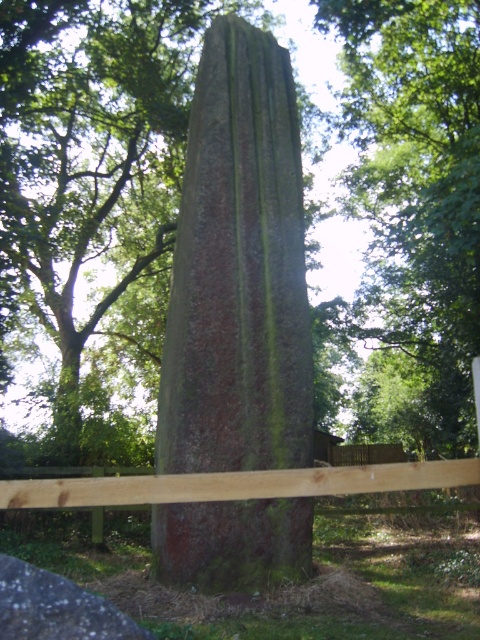
Who is higher up, green mossy stone obelisk at center or green mossy stone at center?

green mossy stone obelisk at center is higher up.

Does green mossy stone obelisk at center have a lesser height compared to green mossy stone at center?

No, green mossy stone obelisk at center is not shorter than green mossy stone at center.

What are the coordinates of `green mossy stone obelisk at center` in the screenshot? It's located at (96, 209).

Can you confirm if green mossy stone at center is positioned to the left of brown wooden fence at center?

Correct, you'll find green mossy stone at center to the left of brown wooden fence at center.

Where is `green mossy stone at center`? green mossy stone at center is located at coordinates (239, 269).

Which is below, green mossy stone obelisk at center or brown wooden fence at center?

Positioned lower is brown wooden fence at center.

Is green mossy stone obelisk at center closer to camera compared to brown wooden fence at center?

No.

Identify the location of green mossy stone obelisk at center. (96, 209).